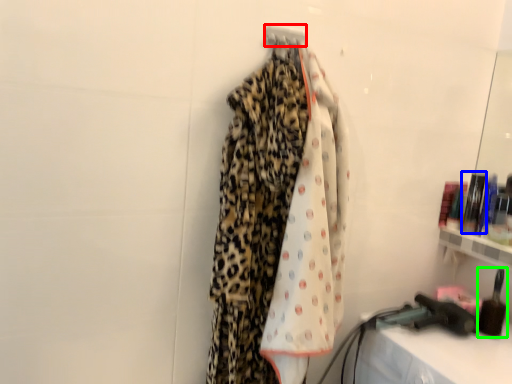
Question: Which object is the farthest from hanger (highlighted by a red box)? Choose among these: toiletry (highlighted by a blue box) or toiletry (highlighted by a green box).

Choices:
 (A) toiletry
 (B) toiletry

Answer: (B)